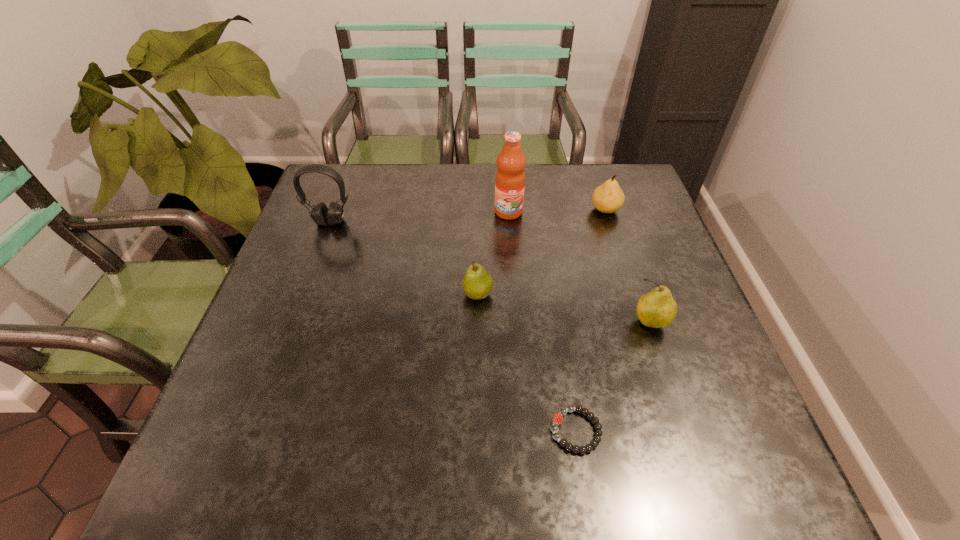
Locate an element on the screen. The image size is (960, 540). object that is positioned at the far right corner is located at coordinates (607, 198).

This screenshot has height=540, width=960. Find the location of `free region at the near edge`. free region at the near edge is located at coordinates (393, 489).

Image resolution: width=960 pixels, height=540 pixels. In the image, there is a desktop. Find the location of `vacant space at the left edge`. vacant space at the left edge is located at coordinates (293, 238).

I want to click on vacant region at the right edge of the desktop, so click(678, 343).

Locate an element on the screen. free spot at the far left corner of the desktop is located at coordinates (350, 177).

Where is `vacant space at the far right corner of the desktop`? This screenshot has height=540, width=960. vacant space at the far right corner of the desktop is located at coordinates (638, 184).

Image resolution: width=960 pixels, height=540 pixels. Find the location of `empty space between the fourth object from left to right and the fruit juice`. empty space between the fourth object from left to right and the fruit juice is located at coordinates (542, 321).

Find the location of a particular element. Image resolution: width=960 pixels, height=540 pixels. vacant area that lies between the second nearest pear and the nearest pear is located at coordinates (564, 308).

Locate an element on the screen. The height and width of the screenshot is (540, 960). unoccupied position between the third object from left to right and the bracelet is located at coordinates (542, 321).

Where is `empty location between the leftmost object and the second nearest object`? This screenshot has width=960, height=540. empty location between the leftmost object and the second nearest object is located at coordinates click(491, 272).